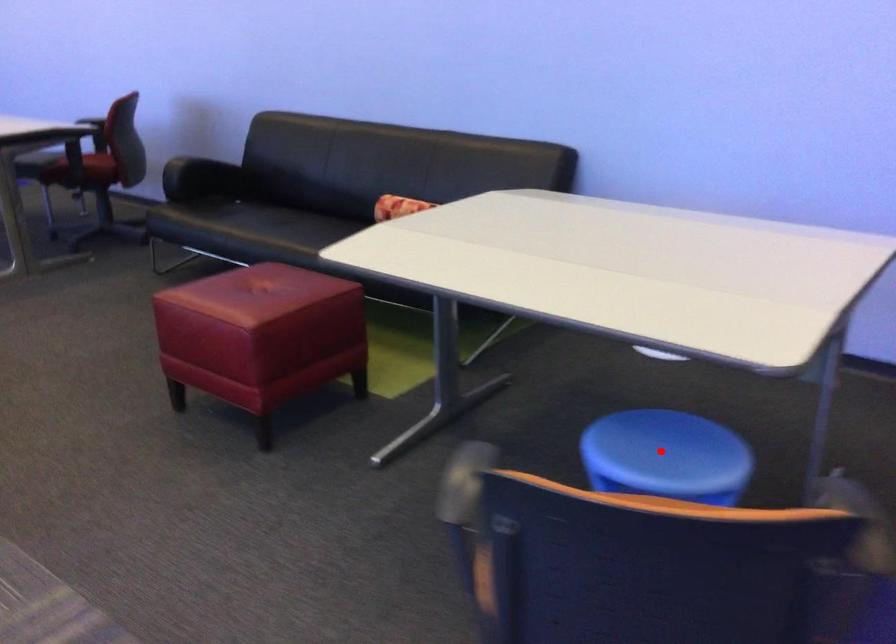
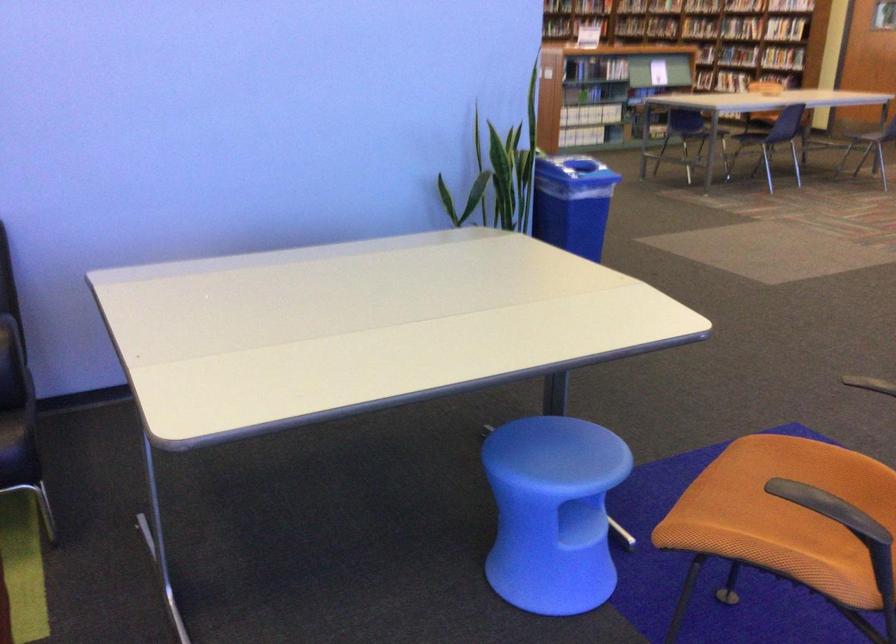
In the second image, find the point that corresponds to the highlighted location in the first image.

(560, 453)